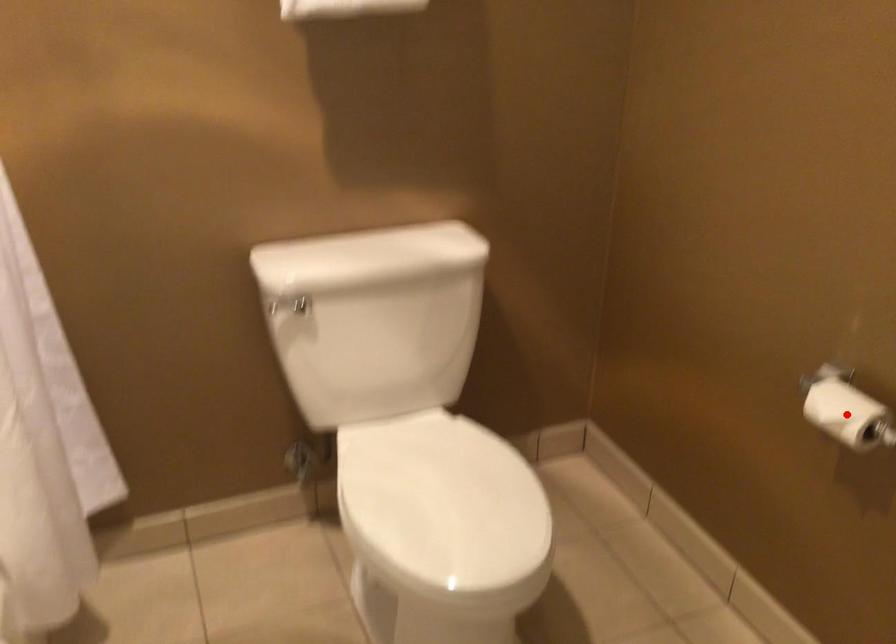
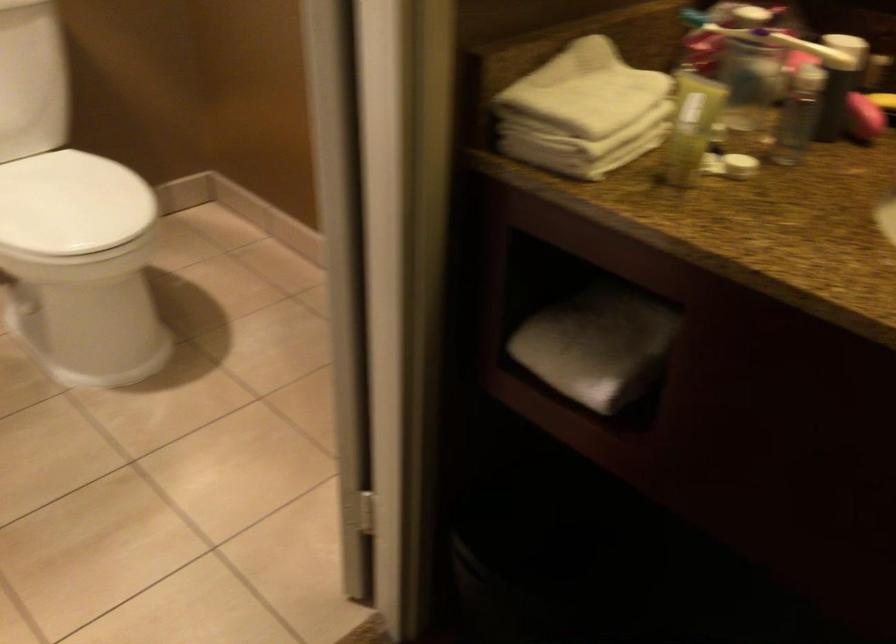
Question: I am providing you with two images of the same scene from different viewpoints. A red point is marked on the first image. Can you still see the location of the red point in image 2?

Choices:
 (A) Yes
 (B) No

Answer: (B)